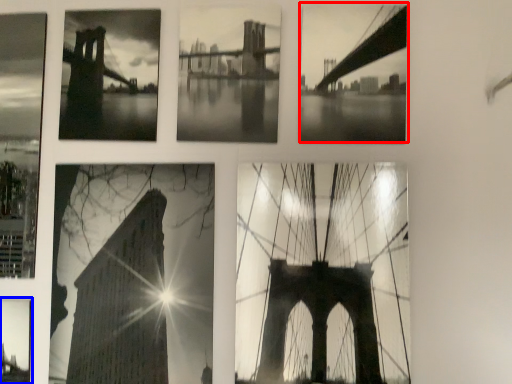
Question: Which of the following is the closest to the observer, picture frame (highlighted by a red box) or picture frame (highlighted by a blue box)?

Choices:
 (A) picture frame
 (B) picture frame

Answer: (A)